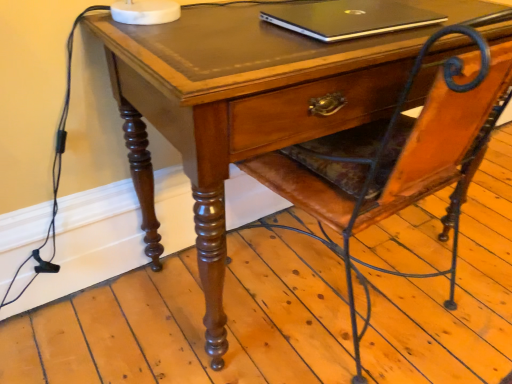
Locate an element on the screen. This screenshot has height=384, width=512. black matte laptop at upper center is located at coordinates (349, 18).

Describe the element at coordinates (349, 18) in the screenshot. This screenshot has height=384, width=512. I see `black matte laptop at upper center` at that location.

What is the approximate width of black matte laptop at upper center?

black matte laptop at upper center is 9.96 inches wide.

What are the coordinates of `black matte laptop at upper center` in the screenshot? It's located at (349, 18).